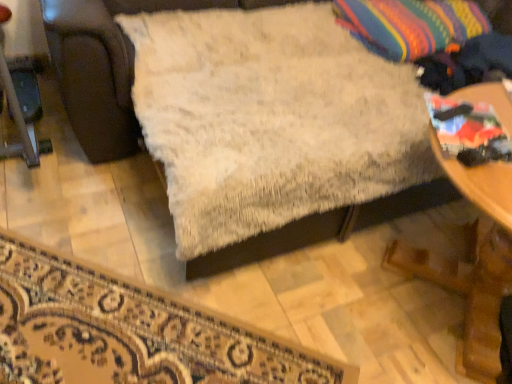
This screenshot has width=512, height=384. I want to click on vacant space behind white fluffy rug at lower center, so 123,226.